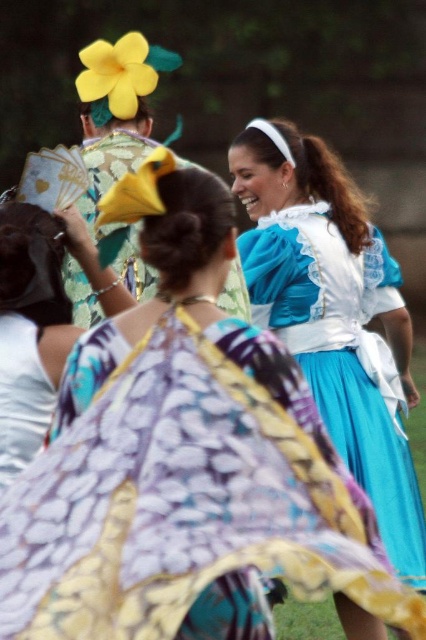
You are a photographer standing at the center of the scene. You want to take a photo of the blue satin dress at center. Where should you aim your camera to capture it?

The blue satin dress at center is located at point 0.492 on the x axis and 0.784 on the y axis, so you should aim your camera towards those coordinates to capture it.

Consider the image. You are a photographer trying to capture the best shot of the two points in the scene. Which point, point [13,324] or point [97,209], is closer to your camera lens?

Point [13,324] is closer to the camera than point [97,209].